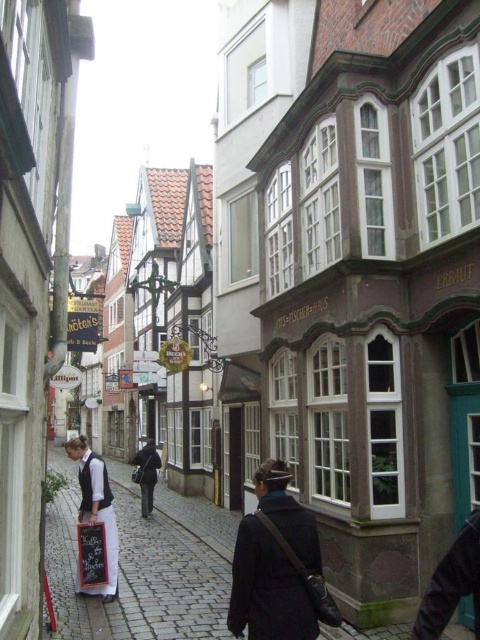
Question: Which of these objects is positioned closest to the white linen apron at lower left?

Choices:
 (A) dark gray coat at center
 (B) dark blue coat at center

Answer: (B)

Question: Is dark blue coat at center positioned in front of white linen apron at lower left?

Choices:
 (A) no
 (B) yes

Answer: (B)

Question: Can you confirm if dark blue coat at center is positioned to the left of white linen apron at lower left?

Choices:
 (A) yes
 (B) no

Answer: (B)

Question: Which is nearer to the white linen apron at lower left?

Choices:
 (A) dark gray coat at center
 (B) dark blue coat at center

Answer: (B)

Question: Which of these objects is positioned farthest from the dark gray coat at center?

Choices:
 (A) dark blue coat at center
 (B) white linen apron at lower left

Answer: (A)

Question: Can you confirm if dark blue coat at center is positioned below dark gray coat at center?

Choices:
 (A) yes
 (B) no

Answer: (B)